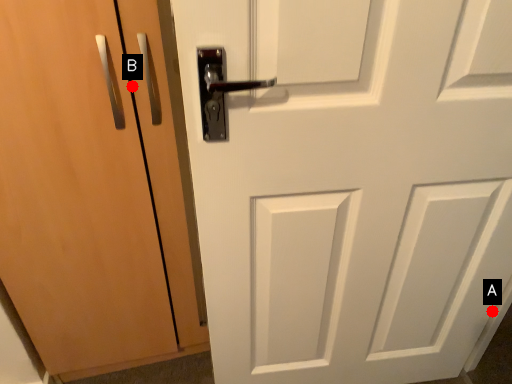
Question: Two points are circled on the image, labeled by A and B beside each circle. Which point appears closest to the camera in this image?

Choices:
 (A) A is closer
 (B) B is closer

Answer: (B)